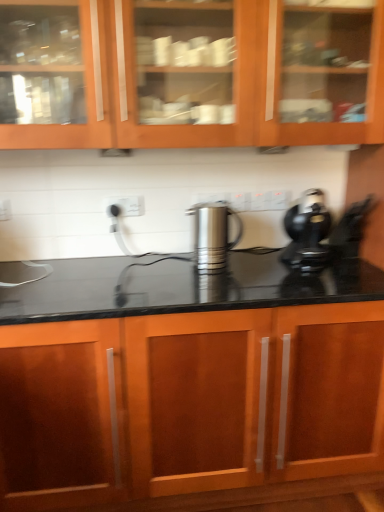
Where is `wooden cabinet at upper center, marked as the 1th cabinetry in a top-to-bottom arrangement`? Image resolution: width=384 pixels, height=512 pixels. wooden cabinet at upper center, marked as the 1th cabinetry in a top-to-bottom arrangement is located at coordinates (190, 73).

What do you see at coordinates (190, 402) in the screenshot?
I see `wooden cabinet at center, arranged as the second cabinetry when viewed from the top` at bounding box center [190, 402].

At what (x,y) coordinates should I click in order to perform the action: click on wooden cabinet at upper center, marked as the 1th cabinetry in a top-to-bottom arrangement. Please return your answer as a coordinate pair (x, y). The image size is (384, 512). Looking at the image, I should click on (190, 73).

Which object is further away from the camera, wooden cabinet at center, arranged as the second cabinetry when viewed from the top, or satin silver kettle at center?

Positioned behind is satin silver kettle at center.

Is wooden cabinet at center, arranged as the second cabinetry when viewed from the top, taller than satin silver kettle at center?

Yes, wooden cabinet at center, arranged as the second cabinetry when viewed from the top, is taller than satin silver kettle at center.

Is wooden cabinet at center, the first cabinetry when ordered from bottom to top, to the right of satin silver kettle at center from the viewer's perspective?

Incorrect, wooden cabinet at center, the first cabinetry when ordered from bottom to top, is not on the right side of satin silver kettle at center.

Could you tell me if wooden cabinet at center, the first cabinetry when ordered from bottom to top, is turned towards satin silver kettle at center?

No, wooden cabinet at center, the first cabinetry when ordered from bottom to top, is not aimed at satin silver kettle at center.

Does black plastic coffee maker at right have a greater height compared to wooden cabinet at center, the first cabinetry when ordered from bottom to top?

No, black plastic coffee maker at right is not taller than wooden cabinet at center, the first cabinetry when ordered from bottom to top.

Is black plastic coffee maker at right to the left of wooden cabinet at center, arranged as the second cabinetry when viewed from the top, from the viewer's perspective?

In fact, black plastic coffee maker at right is to the right of wooden cabinet at center, arranged as the second cabinetry when viewed from the top.

Is wooden cabinet at center, the first cabinetry when ordered from bottom to top, at the back of black plastic coffee maker at right?

No.

Between satin silver kettle at center and wooden cabinet at upper center, the second cabinetry when ordered from bottom to top, which one has smaller size?

Smaller between the two is satin silver kettle at center.

Is satin silver kettle at center looking in the opposite direction of wooden cabinet at upper center, the second cabinetry when ordered from bottom to top?

No, satin silver kettle at center is not facing away from wooden cabinet at upper center, the second cabinetry when ordered from bottom to top.

Is there a large distance between satin silver kettle at center and wooden cabinet at upper center, marked as the 1th cabinetry in a top-to-bottom arrangement?

satin silver kettle at center is near wooden cabinet at upper center, marked as the 1th cabinetry in a top-to-bottom arrangement, not far away.

Considering the sizes of objects satin silver kettle at center and wooden cabinet at upper center, the second cabinetry when ordered from bottom to top, in the image provided, who is shorter, satin silver kettle at center or wooden cabinet at upper center, the second cabinetry when ordered from bottom to top,?

With less height is satin silver kettle at center.

Considering the sizes of objects satin silver kettle at center and wooden cabinet at center, the first cabinetry when ordered from bottom to top, in the image provided, who is thinner, satin silver kettle at center or wooden cabinet at center, the first cabinetry when ordered from bottom to top,?

With smaller width is satin silver kettle at center.

Between point (223, 225) and point (191, 430), which one is positioned behind?

The point (223, 225) is farther from the camera.

Considering the positions of objects satin silver kettle at center and wooden cabinet at center, the first cabinetry when ordered from bottom to top, in the image provided, who is more to the left, satin silver kettle at center or wooden cabinet at center, the first cabinetry when ordered from bottom to top,?

From the viewer's perspective, wooden cabinet at center, the first cabinetry when ordered from bottom to top, appears more on the left side.

Is satin silver kettle at center placed right next to wooden cabinet at center, the first cabinetry when ordered from bottom to top?

satin silver kettle at center and wooden cabinet at center, the first cabinetry when ordered from bottom to top, are not in contact.

In the image, is wooden cabinet at upper center, the second cabinetry when ordered from bottom to top, on the left side or the right side of satin silver kettle at center?

Clearly, wooden cabinet at upper center, the second cabinetry when ordered from bottom to top, is on the left of satin silver kettle at center in the image.

From a real-world perspective, does wooden cabinet at upper center, marked as the 1th cabinetry in a top-to-bottom arrangement, sit lower than satin silver kettle at center?

No, from a real-world perspective, wooden cabinet at upper center, marked as the 1th cabinetry in a top-to-bottom arrangement, is not under satin silver kettle at center.

Does wooden cabinet at upper center, marked as the 1th cabinetry in a top-to-bottom arrangement, have a smaller size compared to satin silver kettle at center?

Incorrect, wooden cabinet at upper center, marked as the 1th cabinetry in a top-to-bottom arrangement, is not smaller in size than satin silver kettle at center.

Is point (164, 26) closer or farther from the camera than point (316, 241)?

Point (164, 26) appears to be closer to the viewer than point (316, 241).

Considering the positions of objects wooden cabinet at upper center, marked as the 1th cabinetry in a top-to-bottom arrangement, and black plastic coffee maker at right in the image provided, who is behind, wooden cabinet at upper center, marked as the 1th cabinetry in a top-to-bottom arrangement, or black plastic coffee maker at right?

black plastic coffee maker at right.

Consider the image. Is wooden cabinet at upper center, the second cabinetry when ordered from bottom to top, not near black plastic coffee maker at right?

No, wooden cabinet at upper center, the second cabinetry when ordered from bottom to top, is not far away from black plastic coffee maker at right.

From the image's perspective, is wooden cabinet at upper center, marked as the 1th cabinetry in a top-to-bottom arrangement, over black plastic coffee maker at right?

Indeed, from the image's perspective, wooden cabinet at upper center, marked as the 1th cabinetry in a top-to-bottom arrangement, is shown above black plastic coffee maker at right.

Considering the relative sizes of wooden cabinet at upper center, the second cabinetry when ordered from bottom to top, and wooden cabinet at center, arranged as the second cabinetry when viewed from the top, in the image provided, is wooden cabinet at upper center, the second cabinetry when ordered from bottom to top, bigger than wooden cabinet at center, arranged as the second cabinetry when viewed from the top,?

Incorrect, wooden cabinet at upper center, the second cabinetry when ordered from bottom to top, is not larger than wooden cabinet at center, arranged as the second cabinetry when viewed from the top.

From the image's perspective, is wooden cabinet at upper center, marked as the 1th cabinetry in a top-to-bottom arrangement, above wooden cabinet at center, arranged as the second cabinetry when viewed from the top?

Indeed, from the image's perspective, wooden cabinet at upper center, marked as the 1th cabinetry in a top-to-bottom arrangement, is shown above wooden cabinet at center, arranged as the second cabinetry when viewed from the top.

Who is taller, wooden cabinet at upper center, marked as the 1th cabinetry in a top-to-bottom arrangement, or wooden cabinet at center, arranged as the second cabinetry when viewed from the top?

With more height is wooden cabinet at center, arranged as the second cabinetry when viewed from the top.

Locate an element on the screen. kitchen appliance that appears above the wooden cabinet at center, arranged as the second cabinetry when viewed from the top (from the image's perspective) is located at coordinates (213, 234).

Where is `home appliance above the wooden cabinet at center, arranged as the second cabinetry when viewed from the top (from a real-world perspective)`? The height and width of the screenshot is (512, 384). home appliance above the wooden cabinet at center, arranged as the second cabinetry when viewed from the top (from a real-world perspective) is located at coordinates (307, 233).

From the image, which object appears to be farther from wooden cabinet at upper center, the second cabinetry when ordered from bottom to top, wooden cabinet at center, the first cabinetry when ordered from bottom to top, or satin silver kettle at center?

wooden cabinet at center, the first cabinetry when ordered from bottom to top.

From the image, which object appears to be nearer to wooden cabinet at upper center, the second cabinetry when ordered from bottom to top, black plastic coffee maker at right or satin silver kettle at center?

The object closer to wooden cabinet at upper center, the second cabinetry when ordered from bottom to top, is satin silver kettle at center.

Looking at the image, which one is located closer to wooden cabinet at upper center, the second cabinetry when ordered from bottom to top, wooden cabinet at center, arranged as the second cabinetry when viewed from the top, or black plastic coffee maker at right?

black plastic coffee maker at right is closer to wooden cabinet at upper center, the second cabinetry when ordered from bottom to top.

From the picture: Which object lies nearer to the anchor point satin silver kettle at center, wooden cabinet at upper center, the second cabinetry when ordered from bottom to top, or black plastic coffee maker at right?

black plastic coffee maker at right lies closer to satin silver kettle at center than the other object.

Looking at the image, which one is located closer to satin silver kettle at center, wooden cabinet at upper center, marked as the 1th cabinetry in a top-to-bottom arrangement, or wooden cabinet at center, arranged as the second cabinetry when viewed from the top?

The object closer to satin silver kettle at center is wooden cabinet at upper center, marked as the 1th cabinetry in a top-to-bottom arrangement.

Estimate the real-world distances between objects in this image. Which object is closer to satin silver kettle at center, wooden cabinet at center, the first cabinetry when ordered from bottom to top, or black plastic coffee maker at right?

black plastic coffee maker at right.

From the image, which object appears to be nearer to black plastic coffee maker at right, wooden cabinet at center, arranged as the second cabinetry when viewed from the top, or wooden cabinet at upper center, the second cabinetry when ordered from bottom to top?

wooden cabinet at center, arranged as the second cabinetry when viewed from the top, is positioned closer to the anchor black plastic coffee maker at right.

Considering their positions, is wooden cabinet at upper center, marked as the 1th cabinetry in a top-to-bottom arrangement, positioned further to wooden cabinet at center, arranged as the second cabinetry when viewed from the top, than satin silver kettle at center?

Among the two, wooden cabinet at upper center, marked as the 1th cabinetry in a top-to-bottom arrangement, is located further to wooden cabinet at center, arranged as the second cabinetry when viewed from the top.

Find the location of a particular element. The width and height of the screenshot is (384, 512). home appliance between wooden cabinet at upper center, marked as the 1th cabinetry in a top-to-bottom arrangement, and wooden cabinet at center, arranged as the second cabinetry when viewed from the top, in the up-down direction is located at coordinates (307, 233).

At what (x,y) coordinates should I click in order to perform the action: click on home appliance between wooden cabinet at upper center, the second cabinetry when ordered from bottom to top, and satin silver kettle at center vertically. Please return your answer as a coordinate pair (x, y). The width and height of the screenshot is (384, 512). Looking at the image, I should click on (307, 233).

You are a GUI agent. You are given a task and a screenshot of the screen. Output one action in this format:
    pyautogui.click(x=<x>, y=<y>)
    Task: Click on the kitchen appliance between black plastic coffee maker at right and wooden cabinet at center, the first cabinetry when ordered from bottom to top, in the vertical direction
    This screenshot has width=384, height=512.
    Given the screenshot: What is the action you would take?
    213,234

The height and width of the screenshot is (512, 384). In order to click on kitchen appliance between wooden cabinet at upper center, marked as the 1th cabinetry in a top-to-bottom arrangement, and wooden cabinet at center, arranged as the second cabinetry when viewed from the top, vertically in this screenshot , I will do `click(213, 234)`.